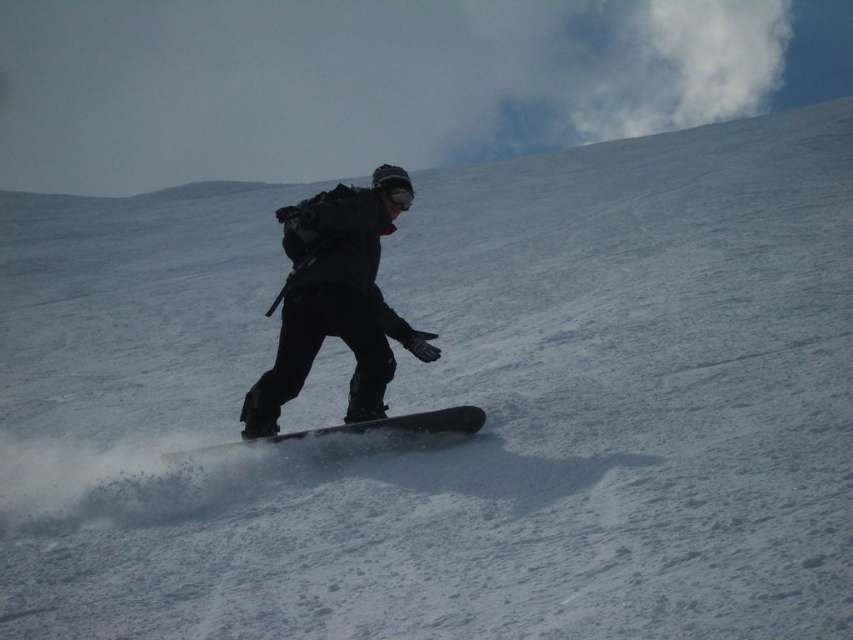
You are a photographer taking a picture of the black matte snowboarder at center and the black matte snowboard at center. Which object is closer to your camera lens?

The black matte snowboarder at center is closer to the camera lens because it is positioned further to the viewer than the black matte snowboard at center.

You are a photographer standing at the bottom of the slope. You want to capture a photo of the black matte snowboarder at center and the black matte snowboard at center. Which object should you focus on first if you want to ensure both are in sharp focus?

The black matte snowboarder at center is much taller than the black matte snowboard at center, so you should focus on the snowboarder first to ensure both are in sharp focus.